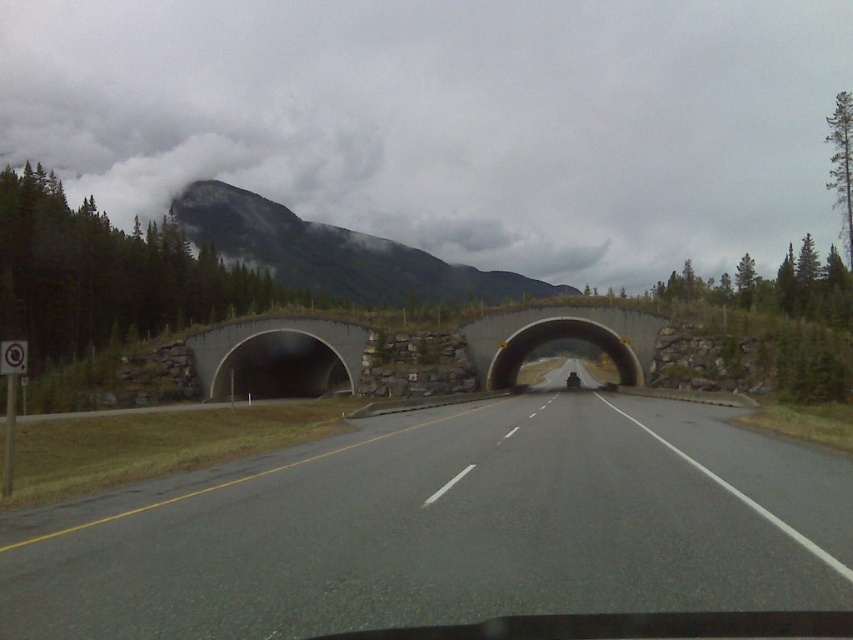
You are a driver approaching the gray concrete tunnel at center. You notice a rocky gray mountain at upper center in the distance. Which object appears bigger from your current viewpoint?

The rocky gray mountain at upper center appears larger than the gray concrete tunnel at center from your current viewpoint.

You are a drone operator trying to capture a photo of the gray asphalt road at center and the rocky gray mountain at upper center. Which object should you focus on if you want to capture the taller one in your shot?

The rocky gray mountain at upper center is taller than the gray asphalt road at center, so you should focus on the rocky gray mountain at upper center to capture the taller one.